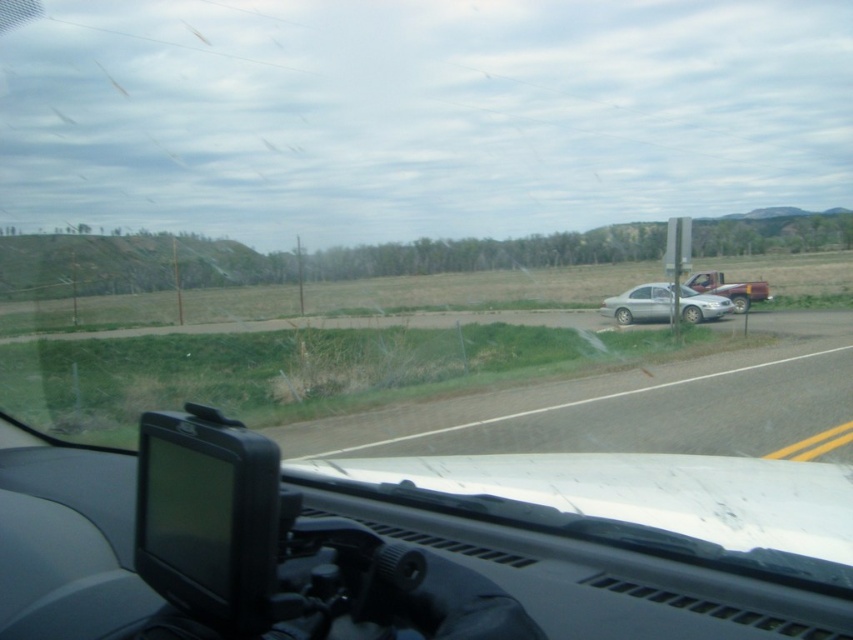
Who is higher up, satin silver sedan at right or matte red truck at right?

matte red truck at right

Is point (646, 285) positioned in front of point (747, 289)?

Yes, it is.

At what (x,y) coordinates should I click in order to perform the action: click on satin silver sedan at right. Please return your answer as a coordinate pair (x, y). Looking at the image, I should click on (640, 304).